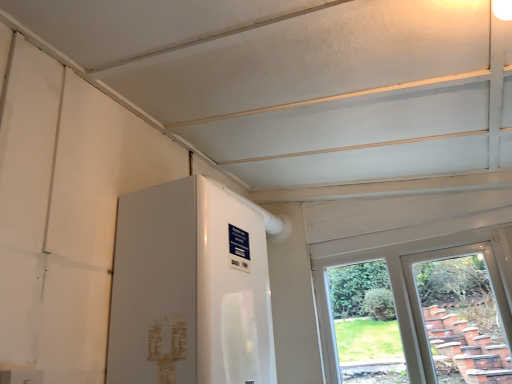
Question: Does clear glass window at right have a larger size compared to white glossy water heater at center?

Choices:
 (A) no
 (B) yes

Answer: (A)

Question: Would you say white glossy water heater at center is part of clear glass window at right's contents?

Choices:
 (A) yes
 (B) no

Answer: (B)

Question: Is clear glass window at right shorter than white glossy water heater at center?

Choices:
 (A) yes
 (B) no

Answer: (B)

Question: From the image's perspective, is clear glass window at right on white glossy water heater at center?

Choices:
 (A) no
 (B) yes

Answer: (A)

Question: Is clear glass window at right at the right side of white glossy water heater at center?

Choices:
 (A) no
 (B) yes

Answer: (B)

Question: Is clear glass window at right far from white glossy water heater at center?

Choices:
 (A) yes
 (B) no

Answer: (A)

Question: Is white glossy water heater at center at the right side of clear glass window at right?

Choices:
 (A) yes
 (B) no

Answer: (B)

Question: Considering the relative sizes of white glossy water heater at center and clear glass window at right in the image provided, is white glossy water heater at center shorter than clear glass window at right?

Choices:
 (A) no
 (B) yes

Answer: (B)

Question: From a real-world perspective, is white glossy water heater at center positioned over clear glass window at right based on gravity?

Choices:
 (A) no
 (B) yes

Answer: (B)

Question: Does white glossy water heater at center have a lesser width compared to clear glass window at right?

Choices:
 (A) no
 (B) yes

Answer: (A)

Question: Is the depth of white glossy water heater at center greater than that of clear glass window at right?

Choices:
 (A) yes
 (B) no

Answer: (B)

Question: From a real-world perspective, is white glossy water heater at center physically below clear glass window at right?

Choices:
 (A) yes
 (B) no

Answer: (B)

Question: Choose the correct answer: Is white glossy water heater at center inside clear glass window at right or outside it?

Choices:
 (A) outside
 (B) inside

Answer: (A)